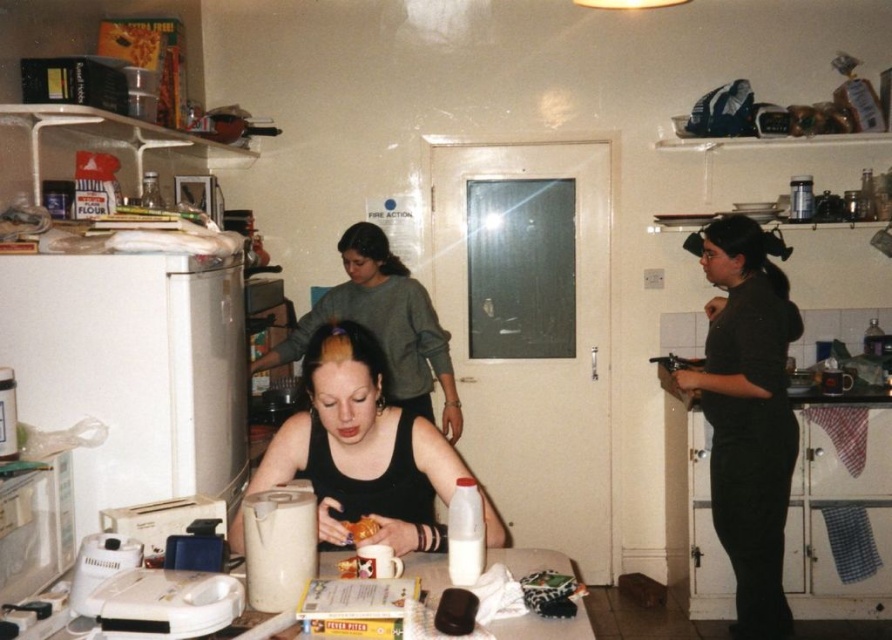
Question: Considering the relative positions of black matte shirt at right and black matte tank top at center in the image provided, where is black matte shirt at right located with respect to black matte tank top at center?

Choices:
 (A) above
 (B) below

Answer: (B)

Question: Which of the following is the farthest from the observer?

Choices:
 (A) (469, 525)
 (B) (145, 198)
 (C) (407, 500)
 (D) (539, 637)

Answer: (B)

Question: Which point is farther from the camera taking this photo?

Choices:
 (A) (154, 173)
 (B) (746, 470)
 (C) (455, 540)

Answer: (A)

Question: Observing the image, what is the correct spatial positioning of white plastic refrigerator at left in reference to black matte tank top at center?

Choices:
 (A) right
 (B) left

Answer: (B)

Question: Is white plastic kettle at lower center wider than clear glass bottle at upper left?

Choices:
 (A) no
 (B) yes

Answer: (A)

Question: Which object is positioned farthest from the black matte tank top at center?

Choices:
 (A) black matte shirt at right
 (B) white glossy table at center
 (C) white plastic kettle at lower center
 (D) white plastic refrigerator at left

Answer: (A)